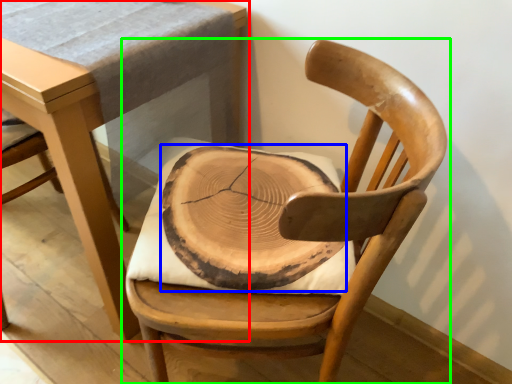
Question: Considering the real-world distances, which object is farthest from table (highlighted by a red box)? pad (highlighted by a blue box) or chair (highlighted by a green box)?

Choices:
 (A) pad
 (B) chair

Answer: (B)